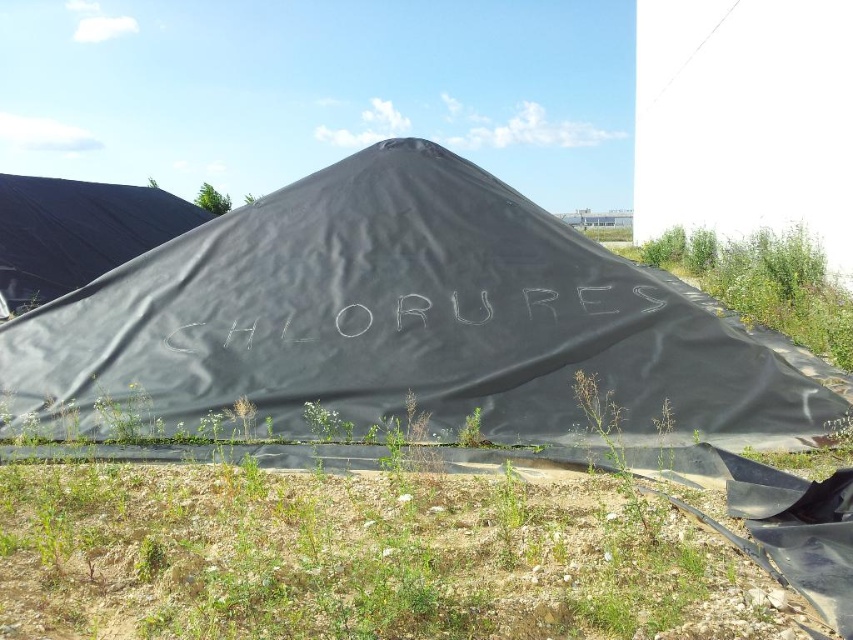
Question: From the image, what is the correct spatial relationship of black tarp at left in relation to white chalk writing at center?

Choices:
 (A) above
 (B) below

Answer: (A)

Question: From the image, what is the correct spatial relationship of black tarp at center in relation to green grass at lower center?

Choices:
 (A) right
 (B) left

Answer: (A)

Question: Which point appears closest to the camera in this image?

Choices:
 (A) (585, 404)
 (B) (193, 346)
 (C) (606, 310)

Answer: (A)

Question: Can you confirm if green grass at lower center is bigger than white chalk writing at center?

Choices:
 (A) yes
 (B) no

Answer: (A)

Question: Which object appears farthest from the camera in this image?

Choices:
 (A) black tarp at center
 (B) green leafy plant at lower center

Answer: (A)

Question: Which point is closer to the camera?

Choices:
 (A) (61, 289)
 (B) (135, 480)

Answer: (B)